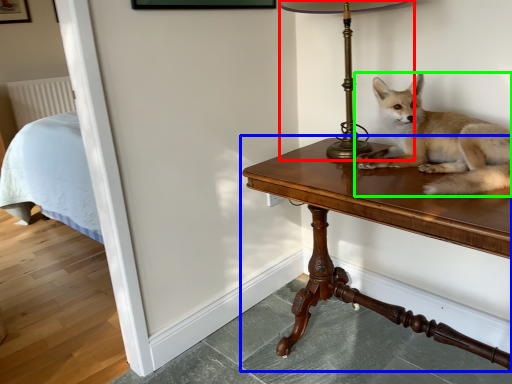
Question: Considering the real-world distances, which object is closest to table lamp (highlighted by a red box)? table (highlighted by a blue box) or dog (highlighted by a green box).

Choices:
 (A) table
 (B) dog

Answer: (B)